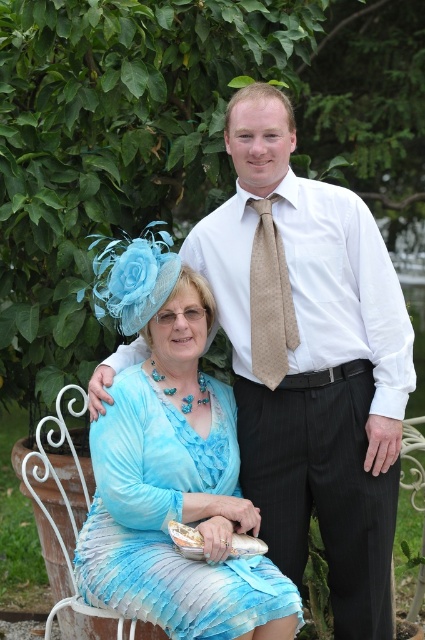
What are the coordinates of the light blue chiffon dress at lower left?

The light blue chiffon dress at lower left is located at coordinates point (169, 518).

You are a photographer adjusting your camera settings to focus on both the white shirt at center and the beige dotted tie at center. Which object should you focus on first to ensure proper depth of field?

The white shirt at center is closer to the viewer than the beige dotted tie at center, so you should focus on the white shirt at center first to ensure proper depth of field.